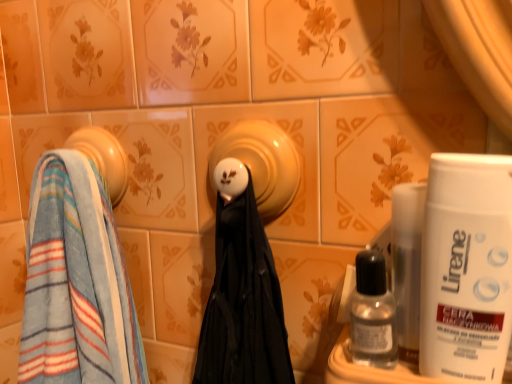
Question: Does matte yellow ceramic at center appear on the left side of white matte shaving cream at right?

Choices:
 (A) yes
 (B) no

Answer: (A)

Question: Can you see matte yellow ceramic at center touching white matte shaving cream at right?

Choices:
 (A) yes
 (B) no

Answer: (B)

Question: Is matte yellow ceramic at center surrounding white matte shaving cream at right?

Choices:
 (A) no
 (B) yes

Answer: (A)

Question: Considering the relative sizes of matte yellow ceramic at center and white matte shaving cream at right in the image provided, is matte yellow ceramic at center smaller than white matte shaving cream at right?

Choices:
 (A) yes
 (B) no

Answer: (A)

Question: From the image's perspective, does matte yellow ceramic at center appear lower than white matte shaving cream at right?

Choices:
 (A) yes
 (B) no

Answer: (B)

Question: Does matte yellow ceramic at center have a lesser height compared to white matte shaving cream at right?

Choices:
 (A) yes
 (B) no

Answer: (A)

Question: Is blue striped towel at left, positioned as the 1th towel in top-to-bottom order, looking in the opposite direction of blue striped towel at left, placed as the first towel when sorted from bottom to top?

Choices:
 (A) no
 (B) yes

Answer: (B)

Question: Can blue striped towel at left, placed as the first towel when sorted from bottom to top, be found inside blue striped towel at left, positioned as the 1th towel in top-to-bottom order?

Choices:
 (A) no
 (B) yes

Answer: (A)

Question: Is blue striped towel at left, positioned as the second towel in bottom-to-top order, in front of blue striped towel at left, placed as the first towel when sorted from bottom to top?

Choices:
 (A) yes
 (B) no

Answer: (B)

Question: From the image's perspective, is blue striped towel at left, positioned as the second towel in bottom-to-top order, under blue striped towel at left, placed as the first towel when sorted from bottom to top?

Choices:
 (A) no
 (B) yes

Answer: (A)

Question: From a real-world perspective, does blue striped towel at left, positioned as the 1th towel in top-to-bottom order, sit lower than blue striped towel at left, the second towel viewed from the top?

Choices:
 (A) yes
 (B) no

Answer: (B)

Question: From a real-world perspective, is blue striped towel at left, positioned as the 1th towel in top-to-bottom order, physically above blue striped towel at left, the second towel viewed from the top?

Choices:
 (A) yes
 (B) no

Answer: (A)

Question: Is transparent plastic bottle at lower right positioned far away from blue striped towel at left, positioned as the second towel in bottom-to-top order?

Choices:
 (A) no
 (B) yes

Answer: (A)